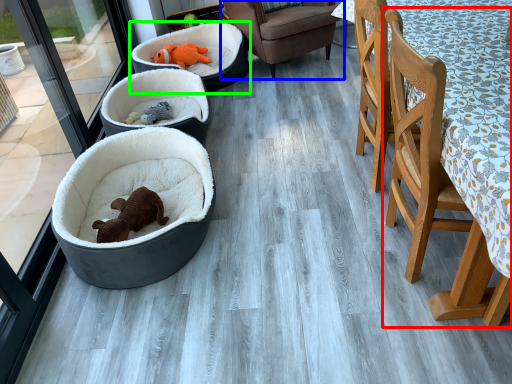
Question: Estimate the real-world distances between objects in this image. Which object is farther from chair (highlighted by a red box), chair (highlighted by a blue box) or dog bed (highlighted by a green box)?

Choices:
 (A) chair
 (B) dog bed

Answer: (B)